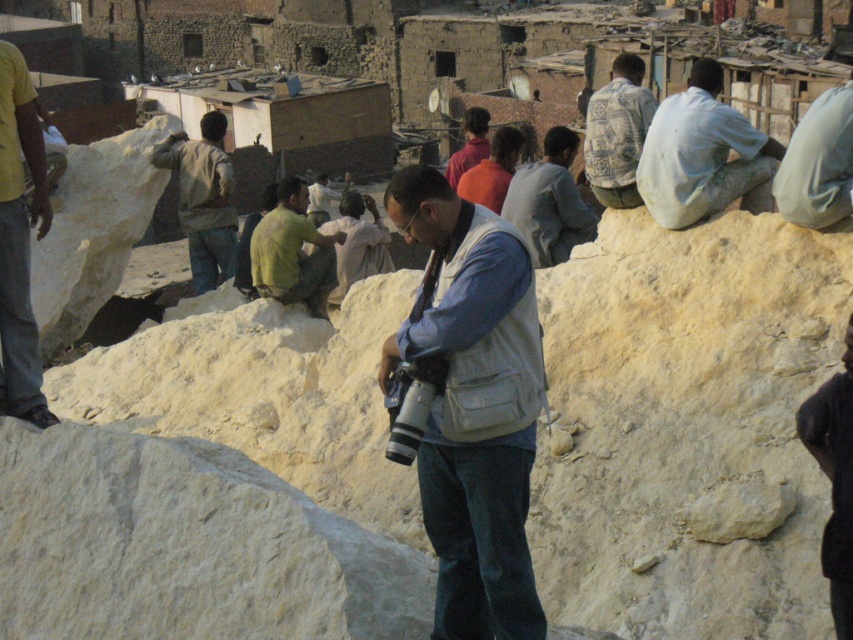
You are a photographer standing at the center of the scene. You need to take a photo of the yellow cotton shirt at left. Where should you position your camera to capture it in the frame?

The yellow cotton shirt at left is located at point 2D coordinates of (x=19, y=241). To capture it in the frame, position your camera so that it faces towards the lower left area of the scene.

You are a photographer standing near the salt mound and you want to take a photo of both the yellow cotton shirt at left and the light gray fabric shirt at upper center. Which shirt should you focus on first to ensure both are in sharp focus?

You should focus on the yellow cotton shirt at left first because it is closer to the viewer than the light gray fabric shirt at upper center. By focusing on the closer object, the depth of field may help keep both in focus.